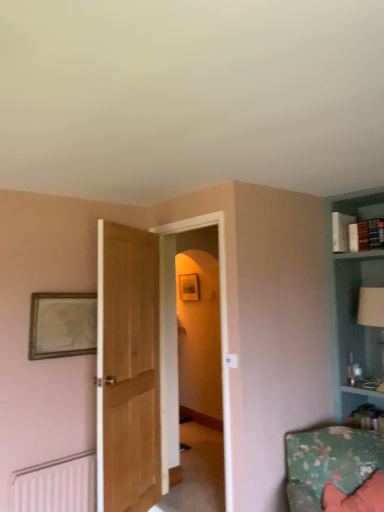
Question: Could you tell me if light brown wood door at center is facing wooden picture frame at upper left?

Choices:
 (A) yes
 (B) no

Answer: (A)

Question: From the image's perspective, is light brown wood door at center located above wooden picture frame at upper left?

Choices:
 (A) yes
 (B) no

Answer: (B)

Question: Is light brown wood door at center shorter than wooden picture frame at upper left?

Choices:
 (A) no
 (B) yes

Answer: (A)

Question: Is light brown wood door at center far from wooden picture frame at upper left?

Choices:
 (A) no
 (B) yes

Answer: (A)

Question: Does light brown wood door at center have a greater width compared to wooden picture frame at upper left?

Choices:
 (A) yes
 (B) no

Answer: (A)

Question: From a real-world perspective, relative to transparent glass door at center, is white glossy table lamp at upper right vertically above or below?

Choices:
 (A) above
 (B) below

Answer: (A)

Question: Does point (360, 303) appear closer or farther from the camera than point (162, 228)?

Choices:
 (A) closer
 (B) farther

Answer: (A)

Question: Is white glossy table lamp at upper right in front of or behind transparent glass door at center in the image?

Choices:
 (A) front
 (B) behind

Answer: (B)

Question: From the image's perspective, relative to transparent glass door at center, is white glossy table lamp at upper right above or below?

Choices:
 (A) below
 (B) above

Answer: (B)

Question: From the image's perspective, is white matte radiator at lower left above or below white glossy table lamp at upper right?

Choices:
 (A) below
 (B) above

Answer: (A)

Question: Would you say white matte radiator at lower left is inside or outside white glossy table lamp at upper right?

Choices:
 (A) outside
 (B) inside

Answer: (A)

Question: From their relative heights in the image, would you say white matte radiator at lower left is taller or shorter than white glossy table lamp at upper right?

Choices:
 (A) tall
 (B) short

Answer: (B)

Question: Considering their positions, is white matte radiator at lower left located in front of or behind white glossy table lamp at upper right?

Choices:
 (A) behind
 (B) front

Answer: (B)

Question: In terms of height, does floral fabric cushion at lower right look taller or shorter compared to wooden picture frame at upper left?

Choices:
 (A) tall
 (B) short

Answer: (B)

Question: From a real-world perspective, is floral fabric cushion at lower right positioned above or below wooden picture frame at upper left?

Choices:
 (A) above
 (B) below

Answer: (B)